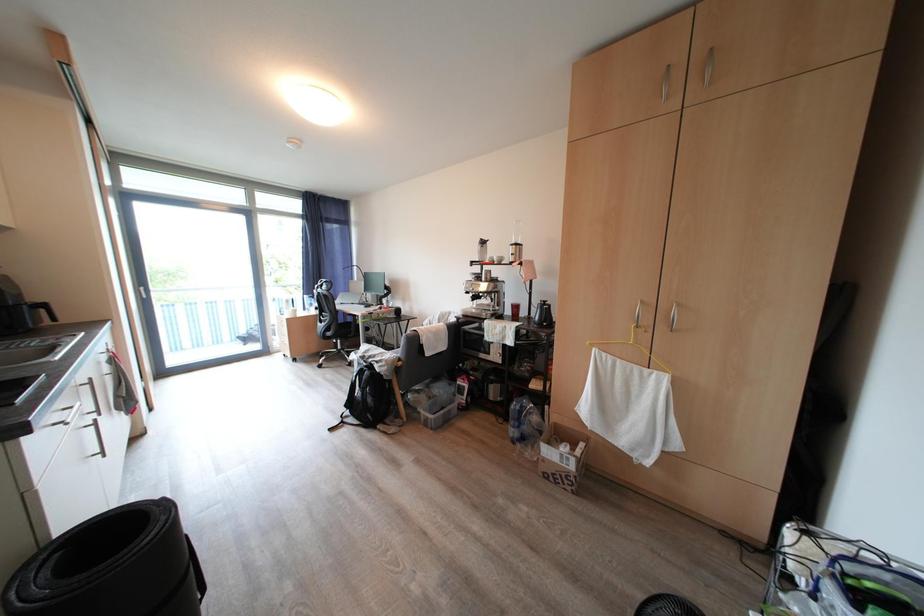
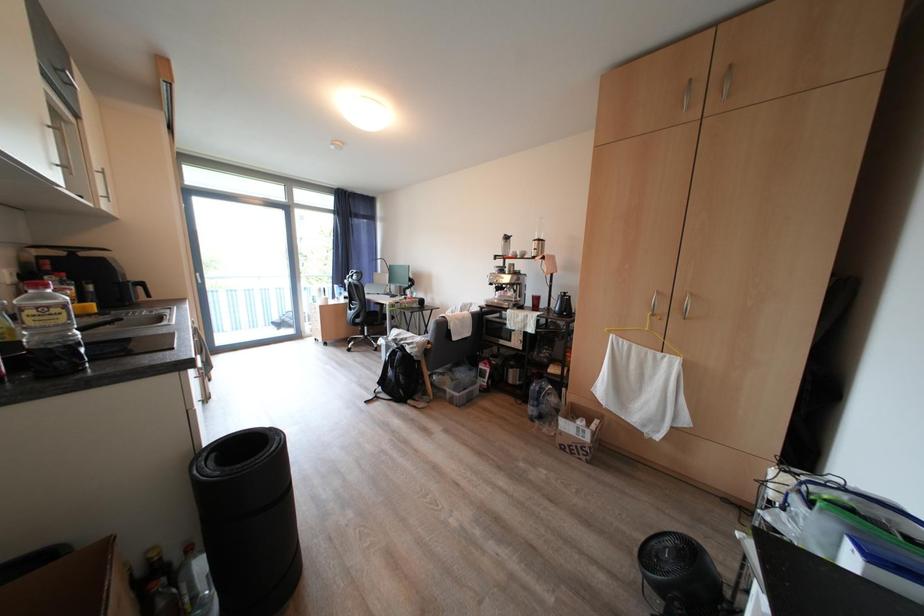
Based on the photo, in a continuous first-person perspective shot, in which direction is the camera moving?

The cameraman moved toward left, backward.